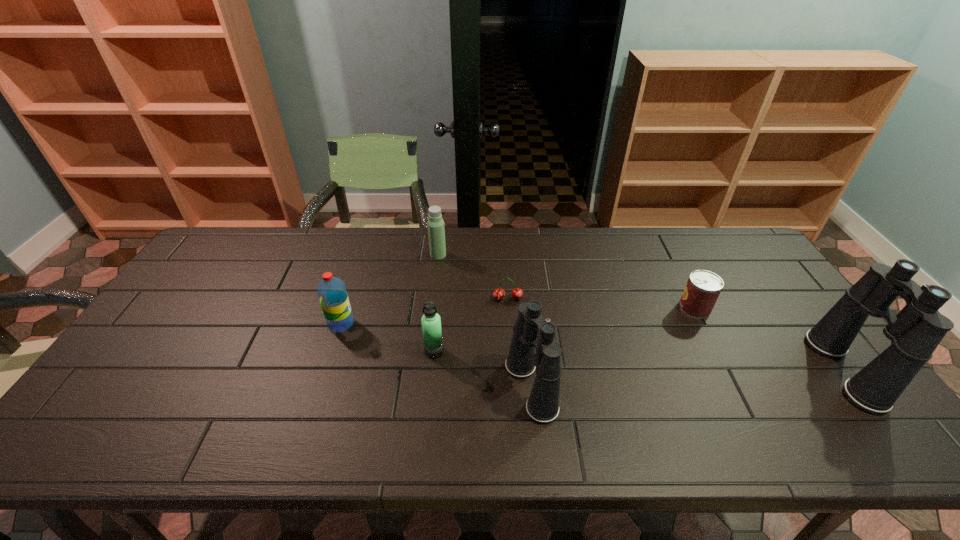
You are a GUI agent. You are given a task and a screenshot of the screen. Output one action in this format:
    pyautogui.click(x=<x>, y=<y>)
    Task: Click on the free point that keeps the binocularss evenly spaced on the left
    Image resolution: width=960 pixels, height=540 pixels.
    Given the screenshot: What is the action you would take?
    pyautogui.click(x=194, y=407)